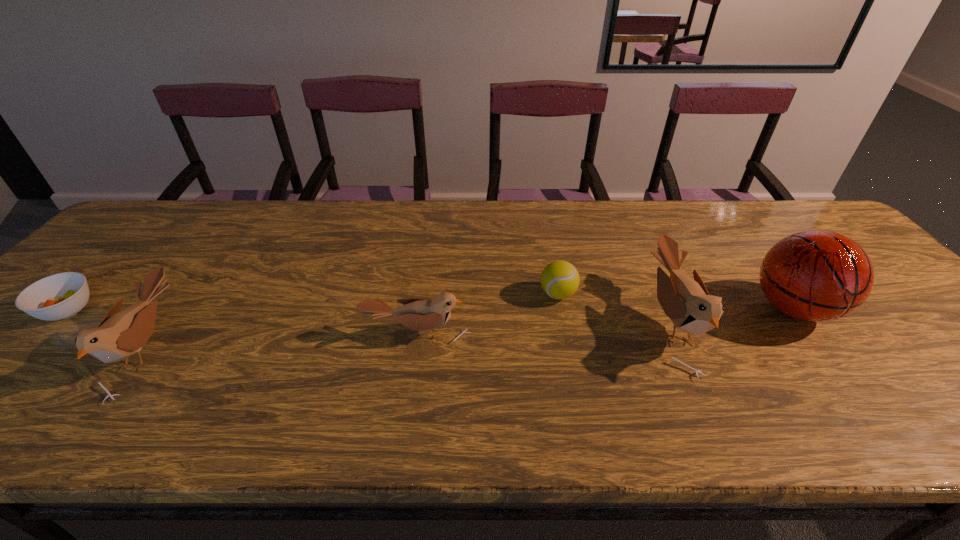
Considering the uniform spacing of birds, where should an additional bird be positioned on the right? Please locate a free spot. Please provide its 2D coordinates. Your answer should be formatted as a tuple, i.e. [(x, y)], where the tuple contains the x and y coordinates of a point satisfying the conditions above.

[(911, 309)]